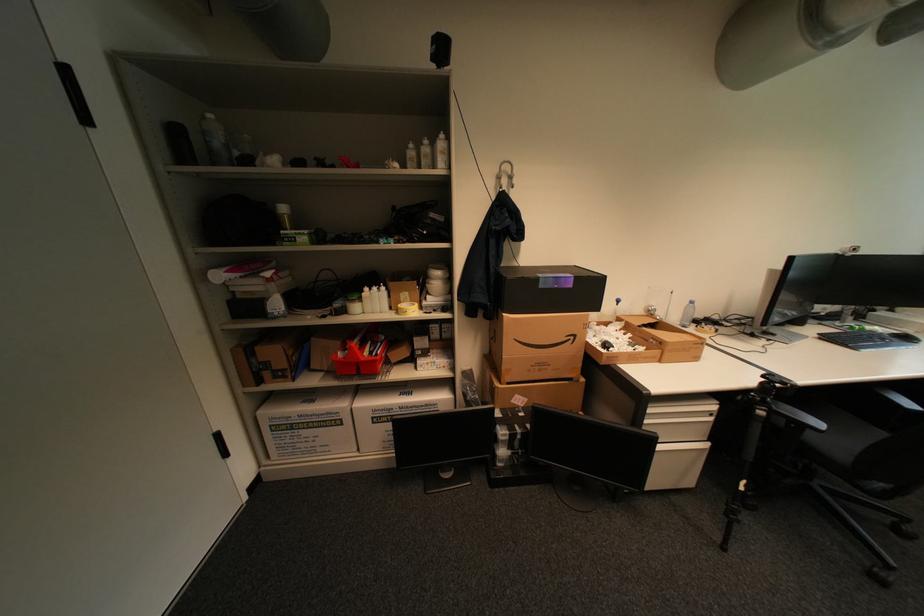
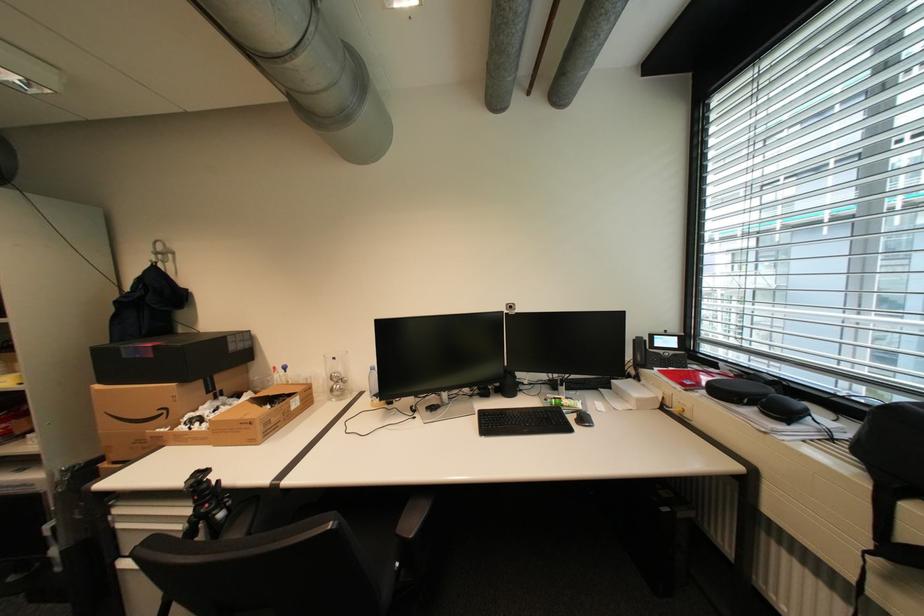
Where in the second image is the point corresponding to point (580, 338) from the first image?

(174, 411)